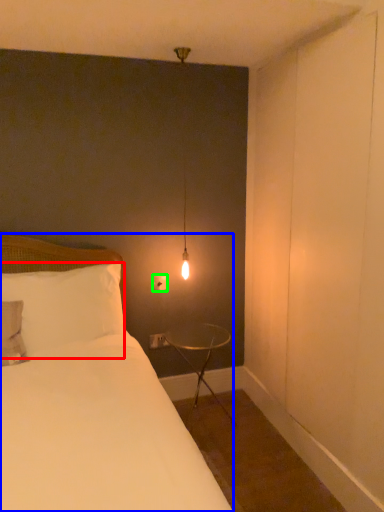
Question: Considering the real-world distances, which object is closest to pillow (highlighted by a red box)? bed (highlighted by a blue box) or electric outlet (highlighted by a green box).

Choices:
 (A) bed
 (B) electric outlet

Answer: (A)